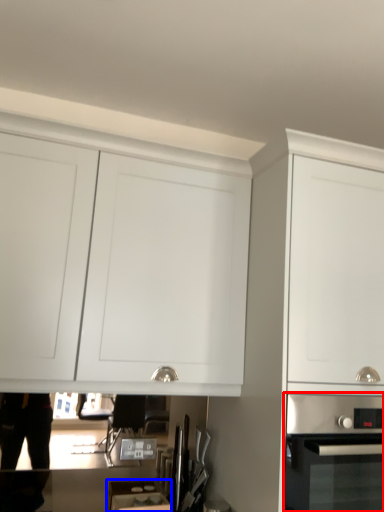
Question: Which of the following is the closest to the observer, home appliance (highlighted by a red box) or appliance (highlighted by a blue box)?

Choices:
 (A) home appliance
 (B) appliance

Answer: (A)